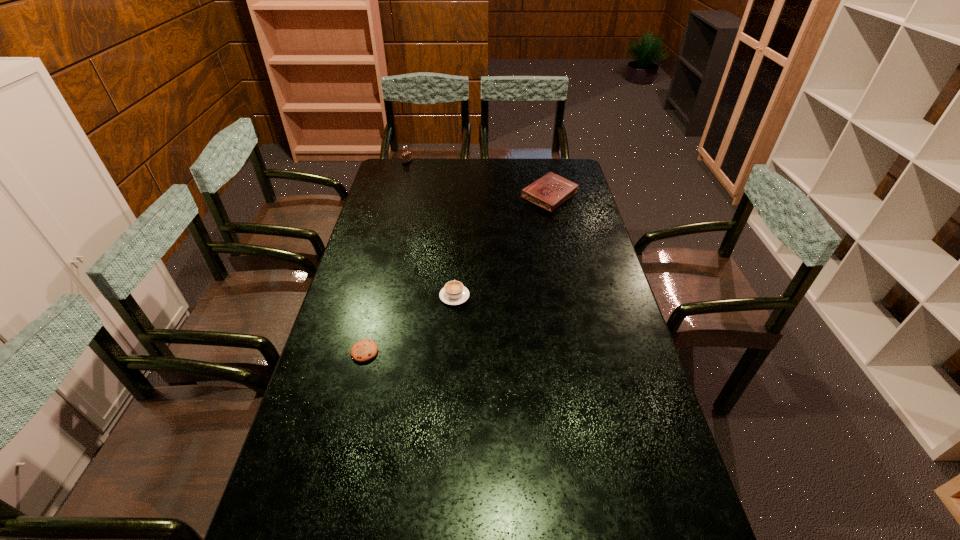
The height and width of the screenshot is (540, 960). Find the location of `the tallest object`. the tallest object is located at coordinates (406, 157).

Where is `padlock`? padlock is located at coordinates tap(406, 157).

Identify the location of hardback book. (550, 191).

Find the location of `the third nearest object`. the third nearest object is located at coordinates (550, 191).

The image size is (960, 540). In order to click on cappuccino in this screenshot , I will do `click(454, 293)`.

Identify the location of the third farthest object. This screenshot has height=540, width=960. (454, 293).

Find the location of a particular element. the nearest object is located at coordinates (364, 350).

Identify the location of the shortest object. (364, 350).

The height and width of the screenshot is (540, 960). Find the location of `free space located on the right of the padlock`. free space located on the right of the padlock is located at coordinates (451, 163).

This screenshot has height=540, width=960. I want to click on vacant position located on the front of the third nearest object, so click(x=556, y=226).